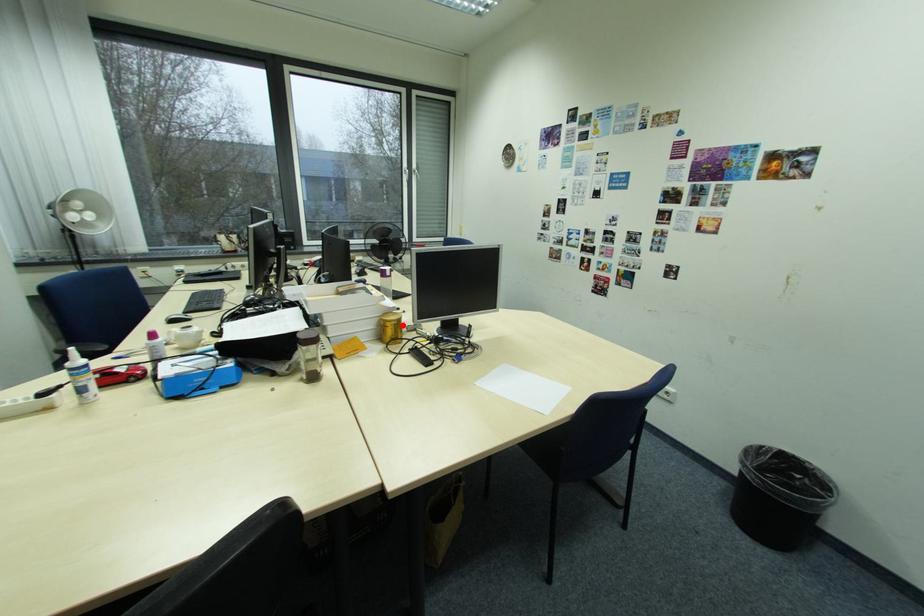
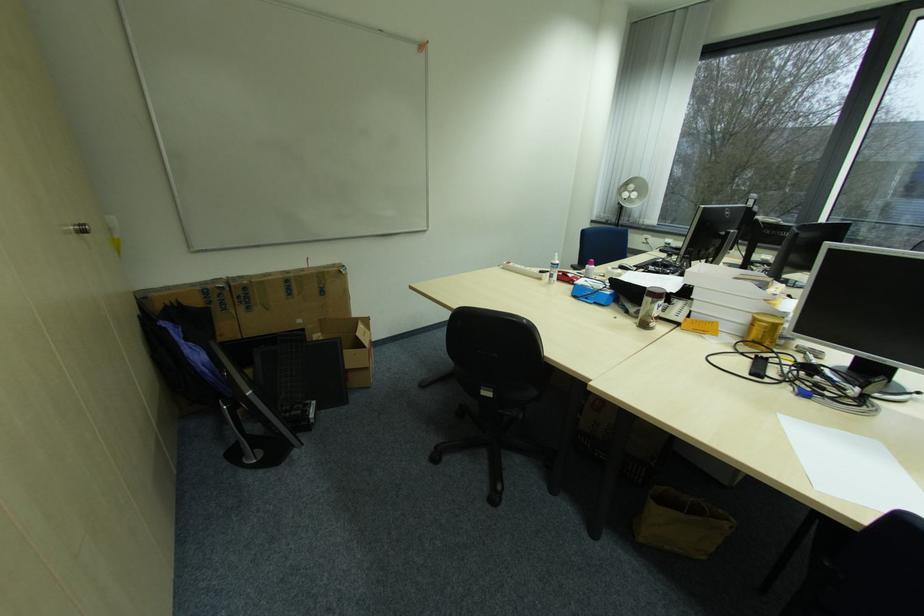
Locate, in the second image, the point that corresponds to the highlighted location in the first image.

(773, 329)